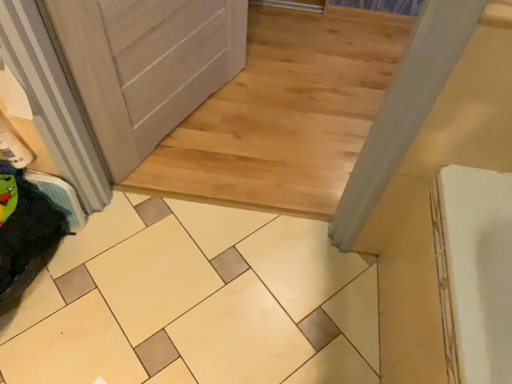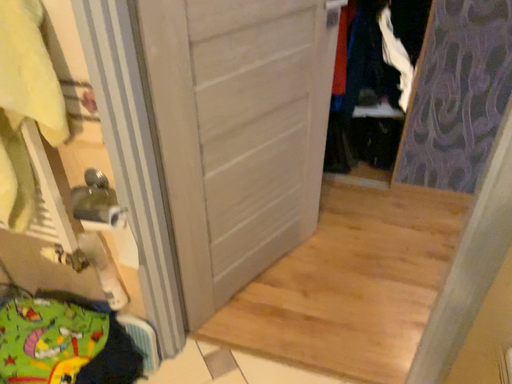
Question: How did the camera likely rotate when shooting the video?

Choices:
 (A) rotated right
 (B) rotated left

Answer: (B)